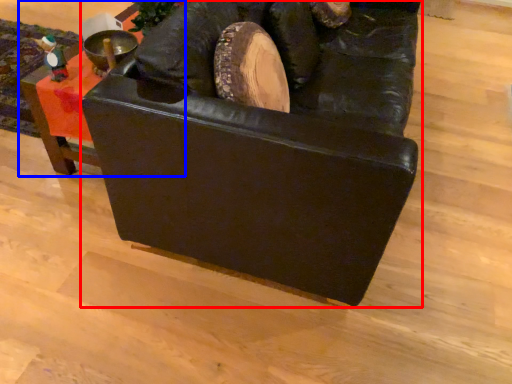
Question: Which of the following is the farthest to the observer, furniture (highlighted by a red box) or furniture (highlighted by a blue box)?

Choices:
 (A) furniture
 (B) furniture

Answer: (B)